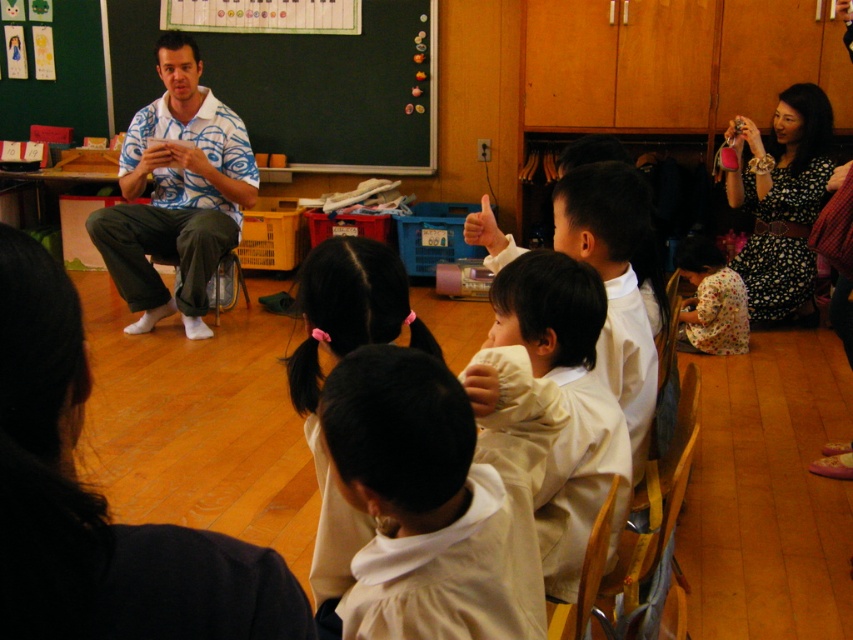
Question: Is white fabric at center positioned behind black dotted dress at upper right?

Choices:
 (A) yes
 (B) no

Answer: (B)

Question: Can you confirm if white fabric at center is positioned to the left of black dotted dress at upper right?

Choices:
 (A) no
 (B) yes

Answer: (B)

Question: Which object is the closest to the black dotted dress at upper right?

Choices:
 (A) blue printed shirt at center
 (B) floral fabric dress at lower right

Answer: (B)

Question: Is black dotted dress at upper right below floral fabric dress at lower right?

Choices:
 (A) yes
 (B) no

Answer: (B)

Question: Which point appears closest to the camera in this image?

Choices:
 (A) (523, 296)
 (B) (688, 298)

Answer: (A)

Question: Which object is the farthest from the green chalkboard at upper center?

Choices:
 (A) black hair at center
 (B) floral fabric dress at lower right
 (C) white soft shirt at center

Answer: (A)